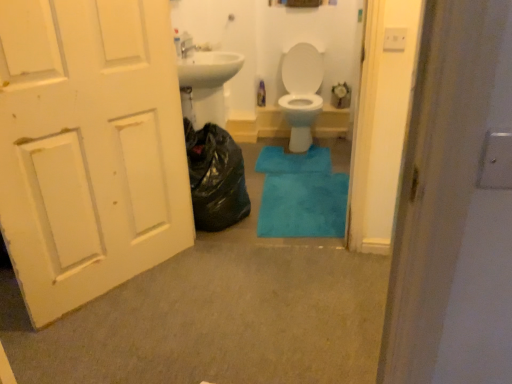
Locate an element on the screen. This screenshot has width=512, height=384. free spot to the right of black plastic bag at left is located at coordinates (286, 208).